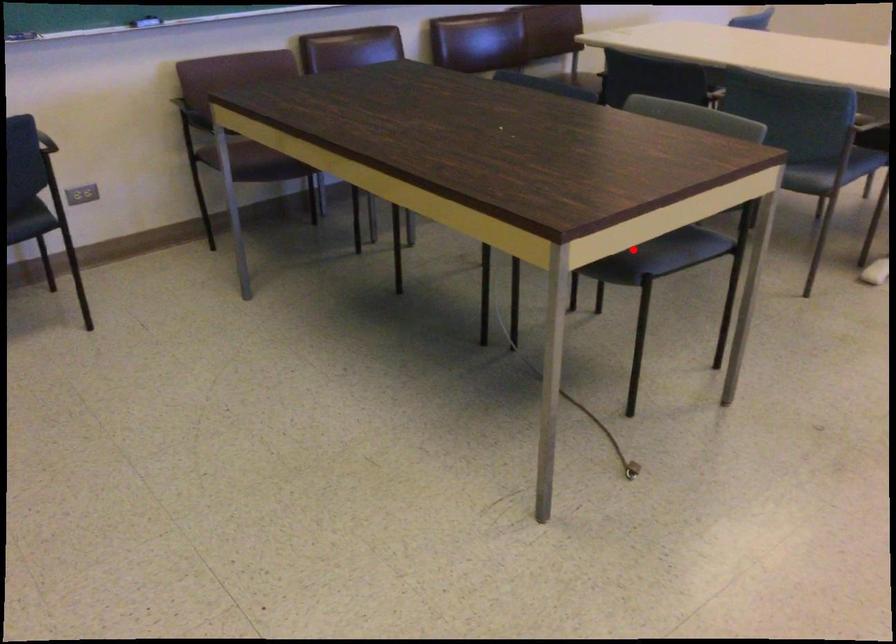
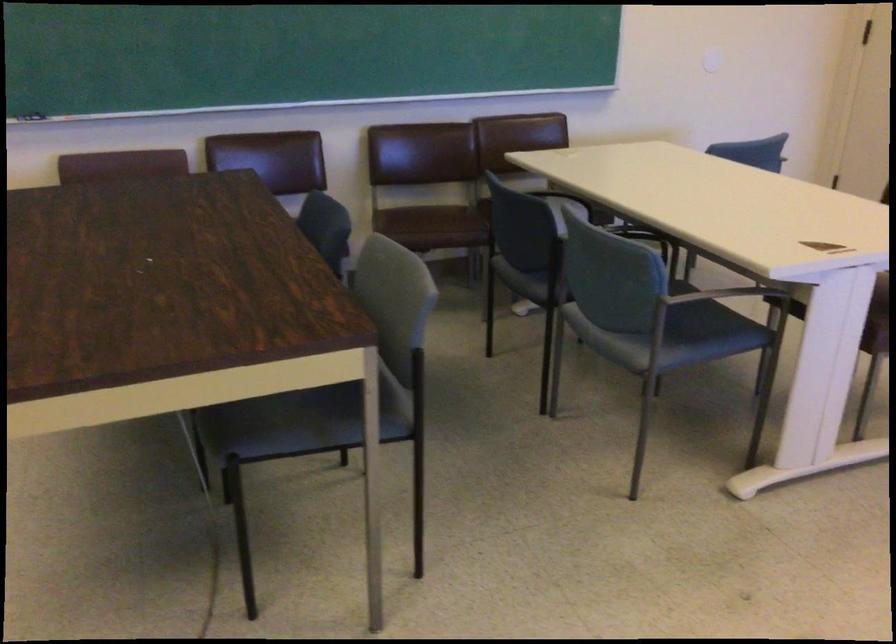
The point at the highlighted location is marked in the first image. Where is the corresponding point in the second image?

(282, 424)